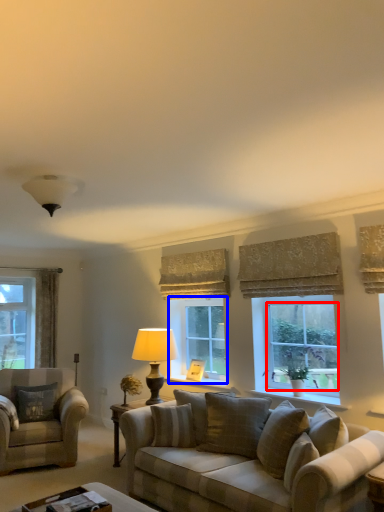
Question: Among these objects, which one is nearest to the camera, window screen (highlighted by a red box) or window (highlighted by a blue box)?

Choices:
 (A) window screen
 (B) window

Answer: (A)